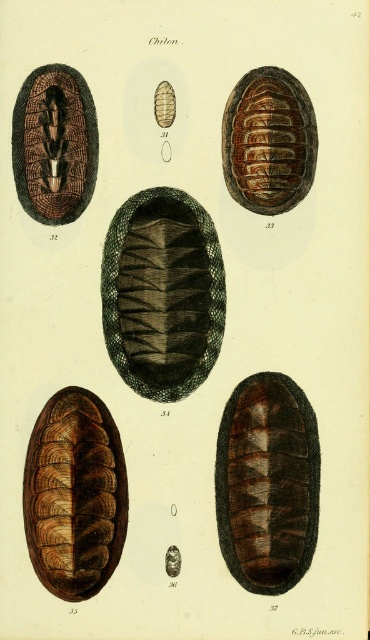
Question: Is brown textured snail at lower left positioned in front of brown textured pill at upper center?

Choices:
 (A) no
 (B) yes

Answer: (B)

Question: Can you confirm if dark green textured snail at center is positioned below brown textured snail at upper left?

Choices:
 (A) no
 (B) yes

Answer: (B)

Question: Which of the following is the closest to the observer?

Choices:
 (A) (237, 122)
 (B) (31, 76)

Answer: (B)

Question: Which object is positioned closest to the brown textured snail at upper left?

Choices:
 (A) brown textured snail at lower left
 (B) brown textured snail at center
 (C) brown textured pill at upper center
 (D) shiny brown shell at center

Answer: (C)

Question: Does brown textured snail at center appear on the left side of brown textured pill at upper center?

Choices:
 (A) yes
 (B) no

Answer: (B)

Question: Which of the following is the closest to the observer?

Choices:
 (A) brown textured snail at center
 (B) brown textured snail at upper left

Answer: (B)